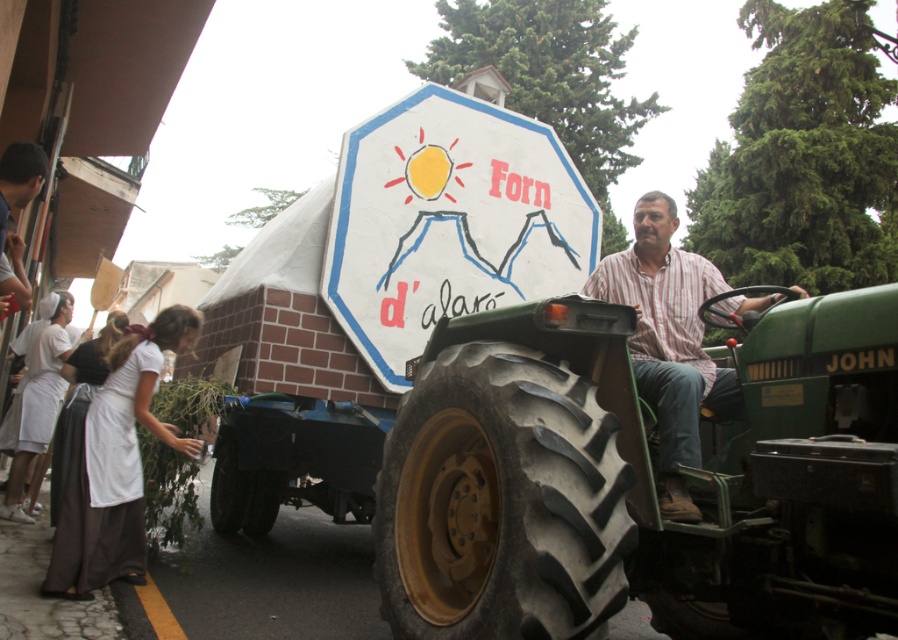
You are a delivery driver who needs to park your truck near the green rubber tractor at center. The parking spot is located at coordinates point 0.742, 0.678. Can you park your truck there?

The green rubber tractor at center is already positioned at point (608, 474), so the parking spot is occupied. Please choose another location.

You are standing at the center of the image and want to find the white painted sign at center. According to the coordinates provided, in which direction should you look to locate it?

The white painted sign at center is located at coordinates point (449, 221), so you should look directly ahead since it is at the center of the image.